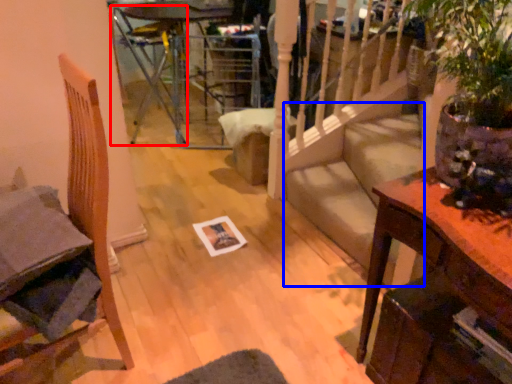
Question: Which object appears farthest to the camera in this image, armchair (highlighted by a red box) or stairwell (highlighted by a blue box)?

Choices:
 (A) armchair
 (B) stairwell

Answer: (A)